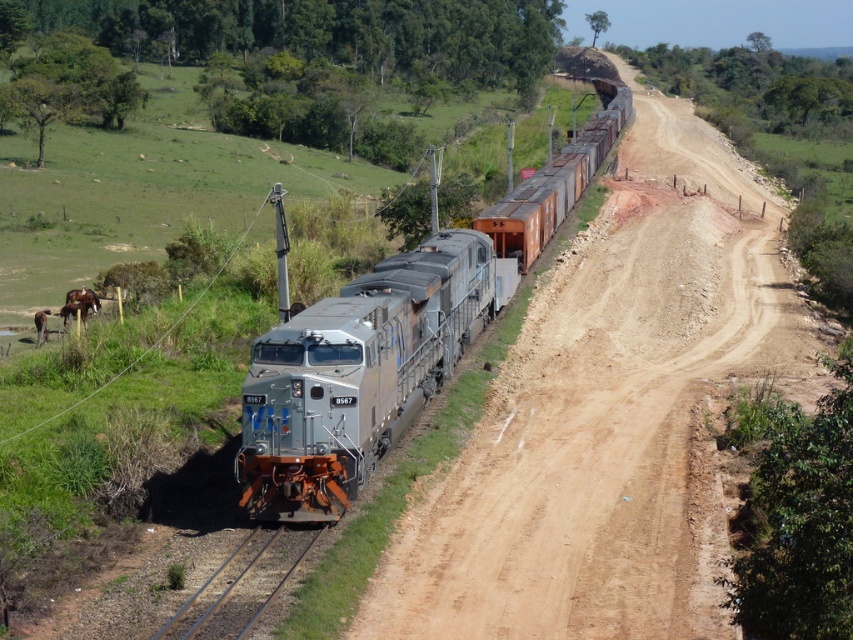
The image size is (853, 640). Find the location of `silver metallic train at center`. silver metallic train at center is located at coordinates (392, 340).

Between silver metallic train at center and silver metallic locomotive at center, which one appears on the left side from the viewer's perspective?

Positioned to the left is silver metallic locomotive at center.

What do you see at coordinates (392, 340) in the screenshot?
I see `silver metallic train at center` at bounding box center [392, 340].

You are a GUI agent. You are given a task and a screenshot of the screen. Output one action in this format:
    pyautogui.click(x=<x>, y=<y>)
    Task: Click on the silver metallic train at center
    
    Given the screenshot: What is the action you would take?
    392,340

Which is above, brown dirt track at center-right or silver metallic locomotive at center?

brown dirt track at center-right is above.

Between brown dirt track at center-right and silver metallic locomotive at center, which one has less height?

silver metallic locomotive at center

This screenshot has width=853, height=640. In order to click on brown dirt track at center-right in this screenshot , I will do `click(608, 416)`.

Image resolution: width=853 pixels, height=640 pixels. In order to click on brown dirt track at center-right in this screenshot , I will do `click(608, 416)`.

Does brown dirt track at center-right have a lesser height compared to metal/smooth train track at lower center?

No.

Who is positioned more to the right, brown dirt track at center-right or metal/smooth train track at lower center?

From the viewer's perspective, brown dirt track at center-right appears more on the right side.

Is point (636, 499) farther from camera compared to point (259, 561)?

Yes, point (636, 499) is behind point (259, 561).

The width and height of the screenshot is (853, 640). Identify the location of brown dirt track at center-right. (608, 416).